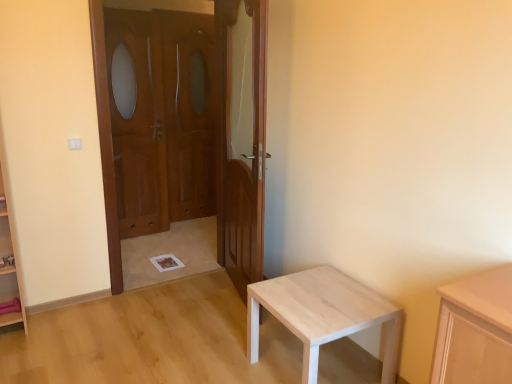
You are a GUI agent. You are given a task and a screenshot of the screen. Output one action in this format:
    pyautogui.click(x=<x>, y=<y>)
    Task: Click on the blank area beneath wooden screen door at center, which is the second screen door from right to left (from a real-world perspective)
    The height and width of the screenshot is (384, 512).
    Given the screenshot: What is the action you would take?
    pyautogui.click(x=147, y=235)